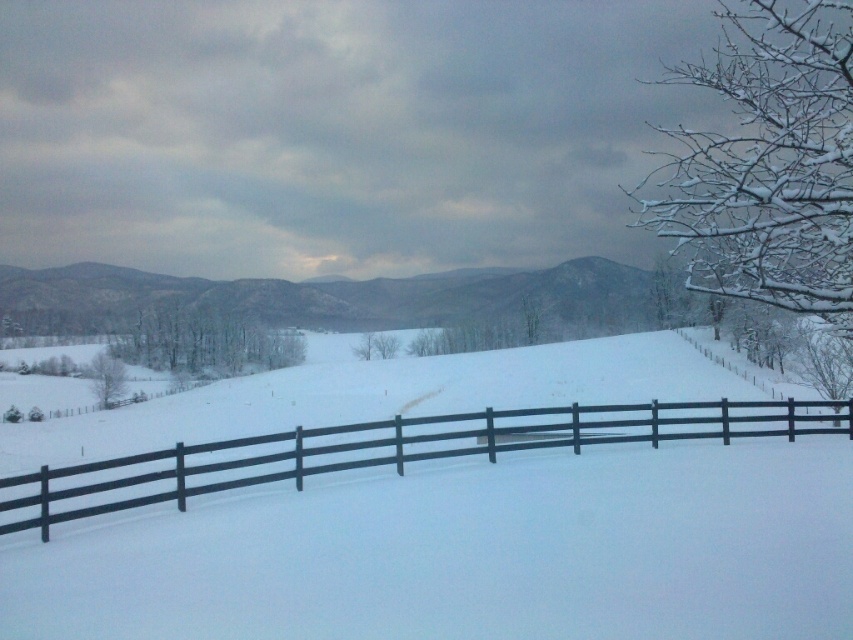
Question: Which point appears farthest from the camera in this image?

Choices:
 (A) (370, 579)
 (B) (251, 436)

Answer: (B)

Question: Among these objects, which one is nearest to the camera?

Choices:
 (A) black wooden fence at center
 (B) white matte snow at center

Answer: (B)

Question: Does white matte snow at center appear over black wooden fence at center?

Choices:
 (A) no
 (B) yes

Answer: (A)

Question: Where is white matte snow at center located in relation to black wooden fence at center in the image?

Choices:
 (A) left
 (B) right

Answer: (A)

Question: Does white matte snow at center have a greater width compared to black wooden fence at center?

Choices:
 (A) no
 (B) yes

Answer: (B)

Question: Which of the following is the closest to the observer?

Choices:
 (A) (596, 438)
 (B) (744, 614)

Answer: (B)